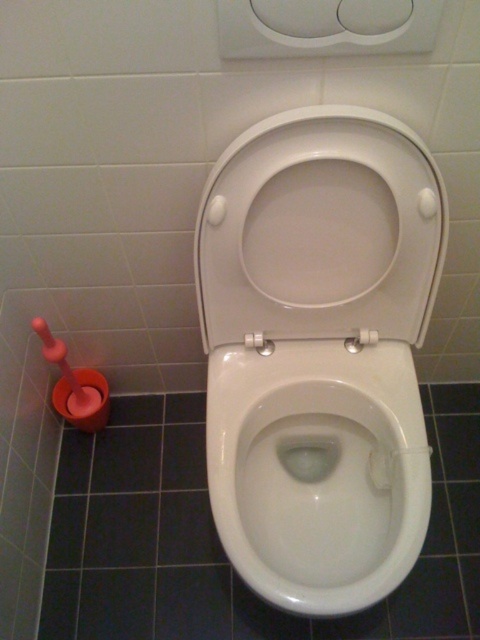
Question: Which point is farther from the camera taking this photo?

Choices:
 (A) (228, 237)
 (B) (224, 538)

Answer: (B)

Question: Does white glossy toilet at center appear on the right side of white glossy toilet bowl at center?

Choices:
 (A) yes
 (B) no

Answer: (B)

Question: Can you confirm if white glossy toilet at center is positioned below white glossy toilet lid at center?

Choices:
 (A) no
 (B) yes

Answer: (B)

Question: Among these points, which one is nearest to the camera?

Choices:
 (A) (265, 145)
 (B) (332, 593)

Answer: (A)

Question: Can you confirm if white glossy toilet at center is positioned below white glossy toilet bowl at center?

Choices:
 (A) yes
 (B) no

Answer: (B)

Question: Among these objects, which one is farthest from the camera?

Choices:
 (A) white glossy toilet lid at center
 (B) white glossy toilet bowl at center
 (C) white glossy toilet at center

Answer: (B)